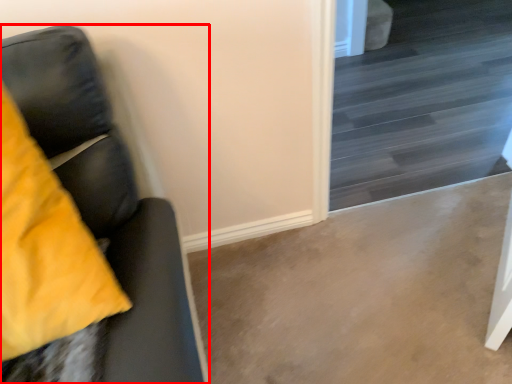
Question: From the image's perspective, where is furniture (annotated by the red box) located in relation to stairwell in the image?

Choices:
 (A) above
 (B) below

Answer: (B)